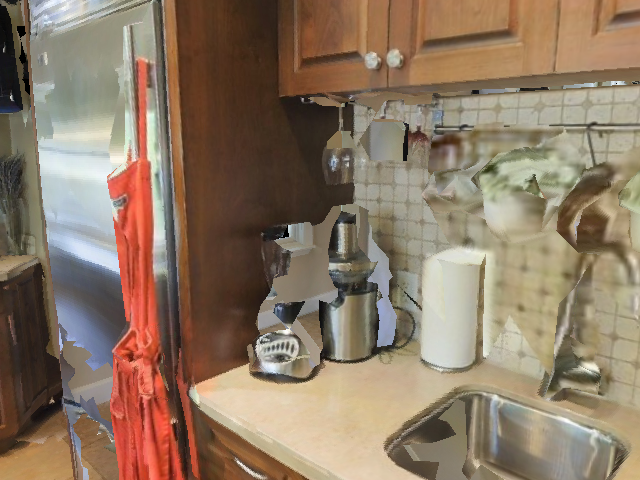
At what (x,y) coordinates should I click in order to perform the action: click on cabinets. Please return your answer as a coordinate pair (x, y). The image size is (640, 480). Looking at the image, I should click on (459, 35), (596, 40), (28, 366).